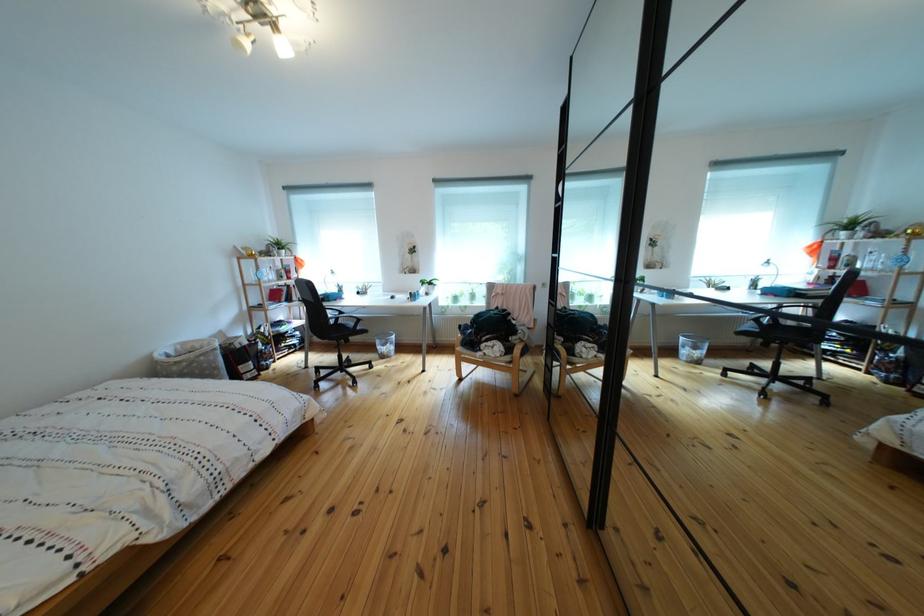
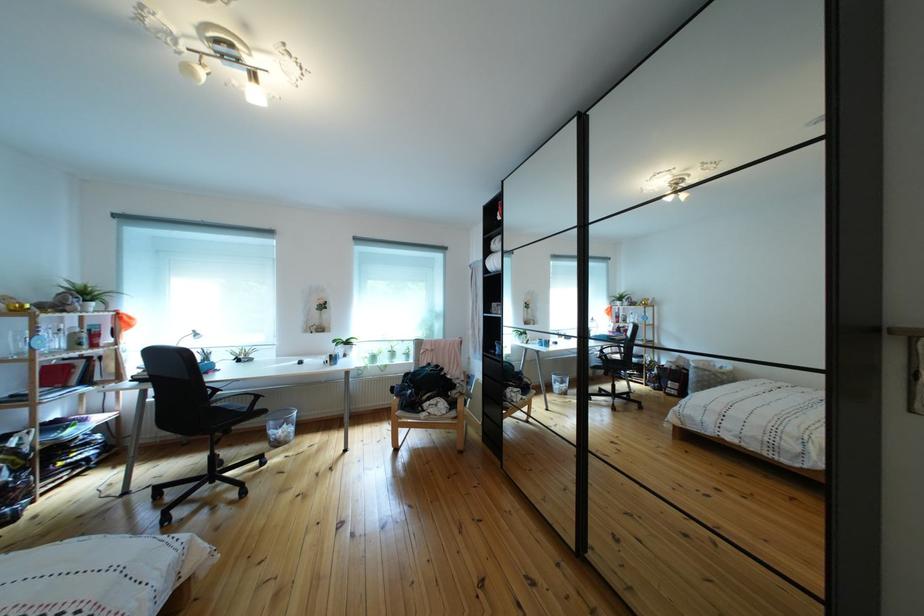
In the second image, find the point that corresponds to the point at 388,347 in the first image.

(283, 430)